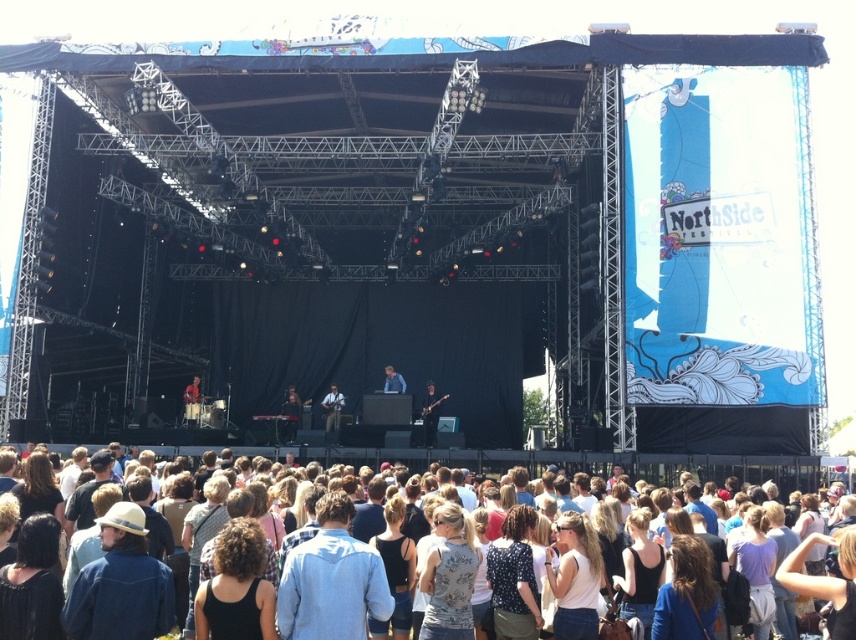
You are standing at the point with coordinates point [287,406] and want to move to the stage. Is the point [423,413] between you and the stage?

Yes, the point [423,413] is between you and the stage because it is in front of point [287,406] where you are standing.

You are a photographer at the Northside Festival concert. You want to capture a clear shot of the matte black guitar at center and the matte black keyboard at center. Which one should you focus on first to ensure it appears sharp in the foreground?

The matte black guitar at center is in front of the matte black keyboard at center, so you should focus on the matte black guitar at center first to ensure it appears sharp in the foreground.

You are a photographer trying to capture a clear shot of the metallic guitar at center and the matte black drum set at center from the front row. Which instrument will appear larger in your photo?

The metallic guitar at center will appear larger in your photo because it is closer to the viewer than the matte black drum set at center.